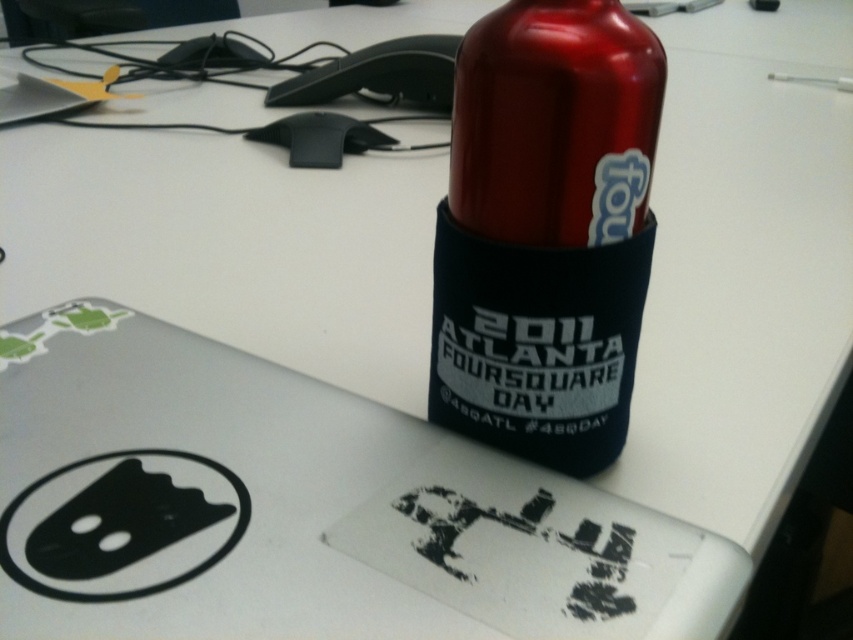
Consider the image. You are trying to locate a specific point on the desk setup. The point is at coordinates (299, 508). Based on the scene description, where would this point be located?

The point at coordinates (299, 508) is located on the silver metallic laptop at upper center.

You are organizing a desk and need to stack items vertically. The silver metallic laptop at upper center and the metallic red bottle at upper right are both candidates. Which item should you place at the bottom to ensure stability?

The silver metallic laptop at upper center has a lesser height compared to the metallic red bottle at upper right, so placing the taller metallic red bottle at upper right at the bottom will provide better stability due to its height and base area.

You are standing at the origin point of the desk coordinate system. There is a metallic red bottle at upper right represented by point [546,230]. What is the coordinate of the metallic red bottle?

The coordinate of the metallic red bottle is point [546,230].